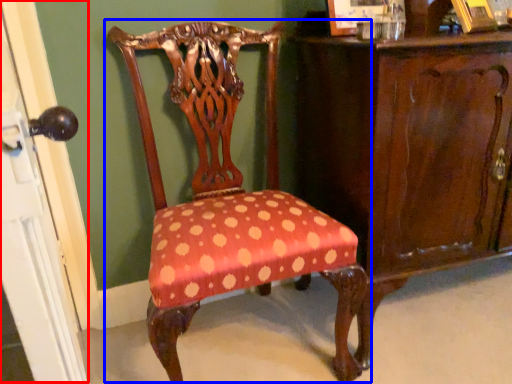
Question: Among these objects, which one is nearest to the camera, screen door (highlighted by a red box) or chair (highlighted by a blue box)?

Choices:
 (A) screen door
 (B) chair

Answer: (A)